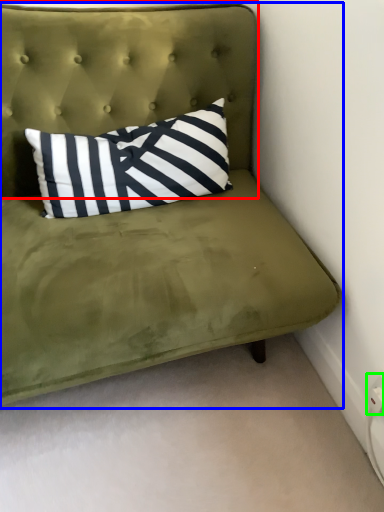
Question: Estimate the real-world distances between objects in this image. Which object is closer to headboard (highlighted by a red box), studio couch (highlighted by a blue box) or electric outlet (highlighted by a green box)?

Choices:
 (A) studio couch
 (B) electric outlet

Answer: (A)